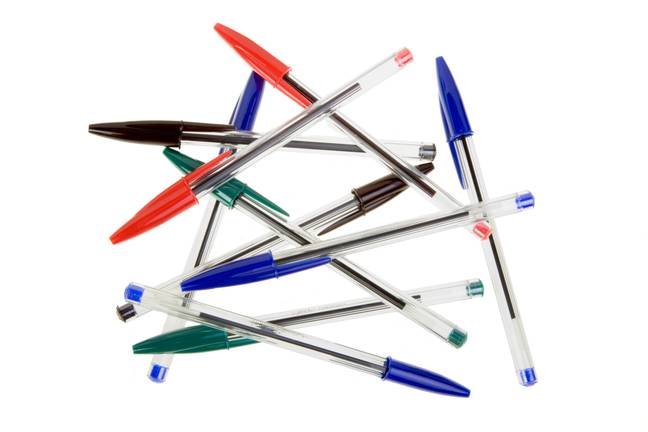
Where is `pen caps`? Image resolution: width=648 pixels, height=432 pixels. pen caps is located at coordinates click(145, 126), click(251, 49), click(167, 206), click(234, 269), click(192, 336), click(227, 189), click(378, 188), click(450, 113), click(422, 376), click(251, 98).